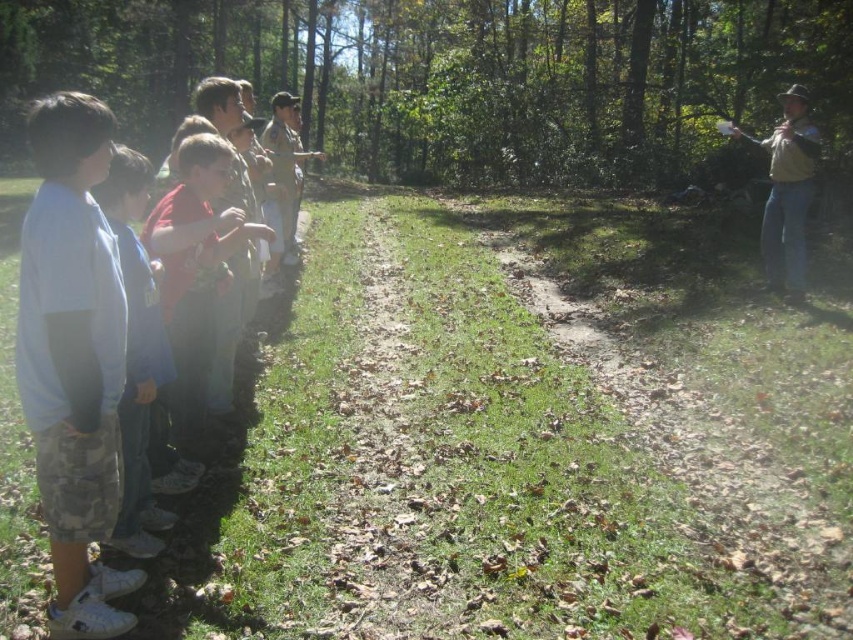
Measure the distance between point (x=109, y=88) and camera.

They are 31.64 meters apart.

Does green leafy forest at upper center appear on the right side of blue denim jeans at left?

Correct, you'll find green leafy forest at upper center to the right of blue denim jeans at left.

Locate an element on the screen. Image resolution: width=853 pixels, height=640 pixels. green leafy forest at upper center is located at coordinates (453, 74).

Can you confirm if green leafy forest at upper center is positioned to the right of light blue cotton shirt at left?

Yes, green leafy forest at upper center is to the right of light blue cotton shirt at left.

Does green leafy forest at upper center have a greater width compared to light blue cotton shirt at left?

Yes, green leafy forest at upper center is wider than light blue cotton shirt at left.

The height and width of the screenshot is (640, 853). In order to click on green leafy forest at upper center in this screenshot , I will do `click(453, 74)`.

Does light blue cotton shirt at left have a larger size compared to blue denim jeans at left?

Incorrect, light blue cotton shirt at left is not larger than blue denim jeans at left.

Is light blue cotton shirt at left thinner than blue denim jeans at left?

Incorrect, light blue cotton shirt at left's width is not less than blue denim jeans at left's.

Between point (105, 401) and point (131, 502), which one is positioned behind?

The point (131, 502) is behind.

The image size is (853, 640). In order to click on light blue cotton shirt at left in this screenshot , I will do `click(73, 358)`.